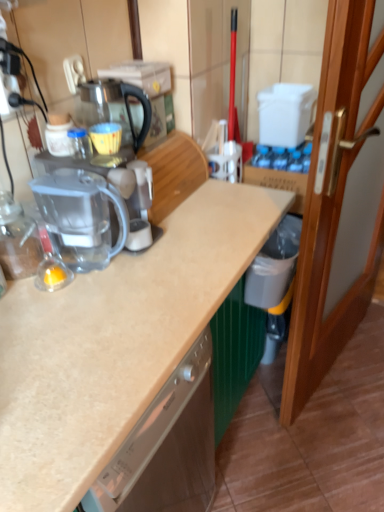
Question: From the image's perspective, is white plastic electric outlet at upper left above transparent plastic blender at left?

Choices:
 (A) no
 (B) yes

Answer: (B)

Question: Considering the relative positions of white plastic electric outlet at upper left and transparent plastic blender at left in the image provided, is white plastic electric outlet at upper left to the left of transparent plastic blender at left from the viewer's perspective?

Choices:
 (A) yes
 (B) no

Answer: (A)

Question: Is there a large distance between white plastic electric outlet at upper left and transparent plastic blender at left?

Choices:
 (A) yes
 (B) no

Answer: (B)

Question: From a real-world perspective, is white plastic electric outlet at upper left positioned over transparent plastic blender at left based on gravity?

Choices:
 (A) yes
 (B) no

Answer: (A)

Question: Is white plastic electric outlet at upper left aimed at transparent plastic blender at left?

Choices:
 (A) yes
 (B) no

Answer: (B)

Question: Is the position of white plastic electric outlet at upper left less distant than that of transparent plastic blender at left?

Choices:
 (A) yes
 (B) no

Answer: (B)

Question: Does transparent glass coffeepot at center have a lesser width compared to transparent plastic coffee machine at center?

Choices:
 (A) no
 (B) yes

Answer: (B)

Question: Is transparent glass coffeepot at center directly adjacent to transparent plastic coffee machine at center?

Choices:
 (A) yes
 (B) no

Answer: (B)

Question: Considering the relative positions of transparent glass coffeepot at center and transparent plastic coffee machine at center in the image provided, is transparent glass coffeepot at center to the left of transparent plastic coffee machine at center from the viewer's perspective?

Choices:
 (A) no
 (B) yes

Answer: (A)

Question: Can you confirm if transparent glass coffeepot at center is shorter than transparent plastic coffee machine at center?

Choices:
 (A) yes
 (B) no

Answer: (A)

Question: Are transparent glass coffeepot at center and transparent plastic coffee machine at center far apart?

Choices:
 (A) yes
 (B) no

Answer: (B)

Question: Is transparent glass coffeepot at center to the right of transparent plastic coffee machine at center from the viewer's perspective?

Choices:
 (A) no
 (B) yes

Answer: (B)

Question: Is transparent plastic blender at left behind transparent plastic coffee machine at center?

Choices:
 (A) no
 (B) yes

Answer: (A)